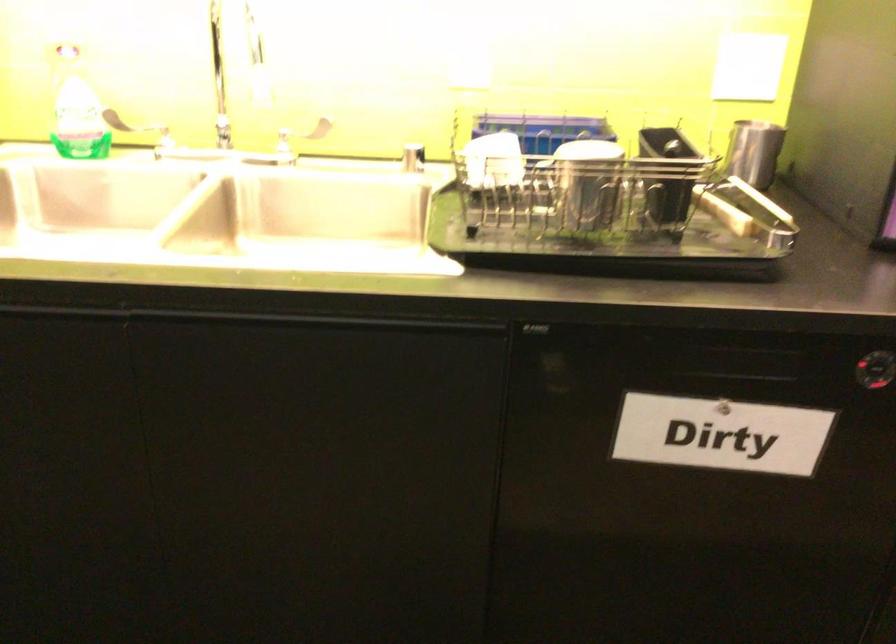
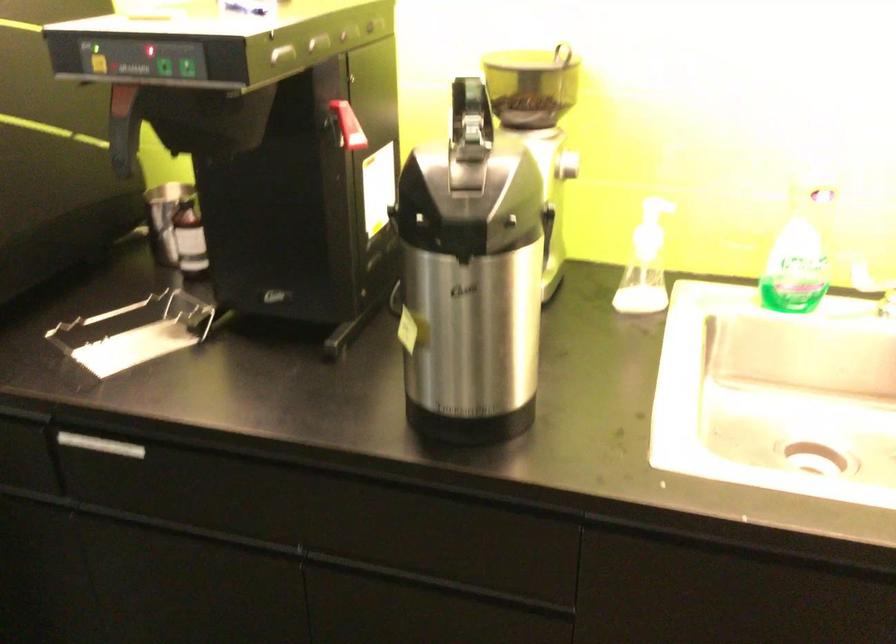
Question: What movement of the cameraman would produce the second image?

Choices:
 (A) Left
 (B) Right
 (C) Forward
 (D) Backward

Answer: (A)